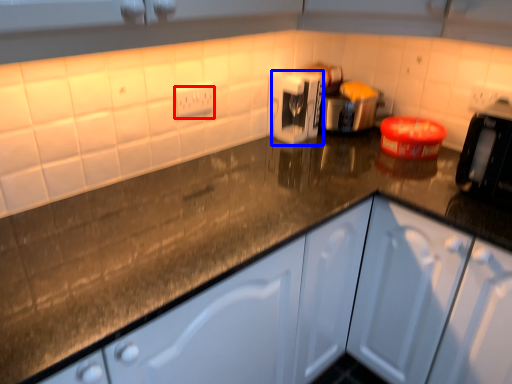
Question: Which object is closer to the camera taking this photo, electric outlet (highlighted by a red box) or appliance (highlighted by a blue box)?

Choices:
 (A) electric outlet
 (B) appliance

Answer: (A)